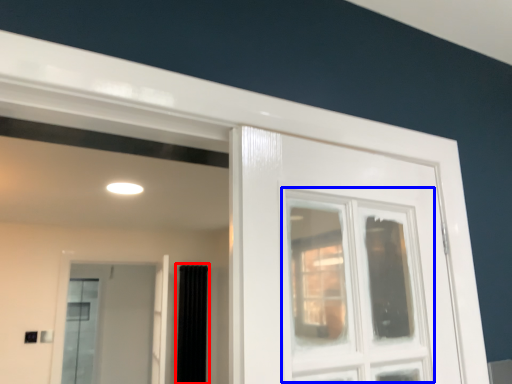
Question: Which point is closer to the camera, curtain (highlighted by a red box) or window (highlighted by a blue box)?

Choices:
 (A) curtain
 (B) window

Answer: (B)